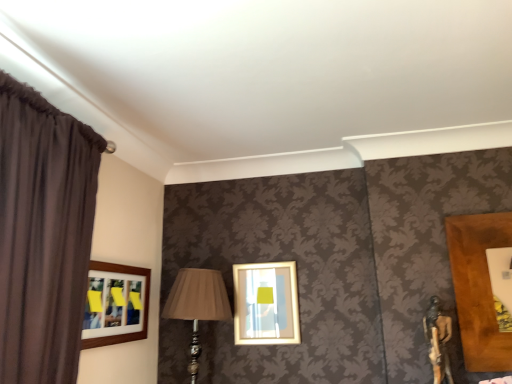
Question: Is matte beige fabric at center taller than wooden-framed picture at left, placed as the 1th picture frame when sorted from left to right?

Choices:
 (A) no
 (B) yes

Answer: (B)

Question: Does matte beige fabric at center have a larger size compared to wooden-framed picture at left, placed as the 1th picture frame when sorted from left to right?

Choices:
 (A) yes
 (B) no

Answer: (A)

Question: From the image's perspective, is matte beige fabric at center located beneath wooden-framed picture at left, placed as the 1th picture frame when sorted from left to right?

Choices:
 (A) yes
 (B) no

Answer: (A)

Question: Considering the relative positions of matte beige fabric at center and wooden-framed picture at left, placed as the second picture frame when sorted from right to left, in the image provided, is matte beige fabric at center to the left of wooden-framed picture at left, placed as the second picture frame when sorted from right to left, from the viewer's perspective?

Choices:
 (A) no
 (B) yes

Answer: (A)

Question: From a real-world perspective, is matte beige fabric at center positioned over wooden-framed picture at left, placed as the second picture frame when sorted from right to left, based on gravity?

Choices:
 (A) yes
 (B) no

Answer: (B)

Question: From their relative heights in the image, would you say matte beige fabric at center is taller or shorter than matte gold picture frame at center, arranged as the 2th picture frame when viewed from the left?

Choices:
 (A) short
 (B) tall

Answer: (B)

Question: Visually, is matte beige fabric at center positioned to the left or to the right of matte gold picture frame at center, which ranks as the 1th picture frame in right-to-left order?

Choices:
 (A) left
 (B) right

Answer: (A)

Question: From the image's perspective, relative to matte gold picture frame at center, which ranks as the 1th picture frame in right-to-left order, is matte beige fabric at center above or below?

Choices:
 (A) below
 (B) above

Answer: (A)

Question: Do you think matte beige fabric at center is within matte gold picture frame at center, which ranks as the 1th picture frame in right-to-left order, or outside of it?

Choices:
 (A) outside
 (B) inside

Answer: (A)

Question: Is dark brown fabric curtain at left spatially inside wooden-framed picture at left, placed as the second picture frame when sorted from right to left, or outside of it?

Choices:
 (A) outside
 (B) inside

Answer: (A)

Question: In terms of size, does dark brown fabric curtain at left appear bigger or smaller than wooden-framed picture at left, placed as the second picture frame when sorted from right to left?

Choices:
 (A) small
 (B) big

Answer: (B)

Question: In the image, is dark brown fabric curtain at left positioned in front of or behind wooden-framed picture at left, placed as the second picture frame when sorted from right to left?

Choices:
 (A) front
 (B) behind

Answer: (A)

Question: Is point (50, 115) closer or farther from the camera than point (97, 279)?

Choices:
 (A) closer
 (B) farther

Answer: (A)

Question: Is wooden-framed picture at left, placed as the second picture frame when sorted from right to left, bigger or smaller than dark brown fabric curtain at left?

Choices:
 (A) small
 (B) big

Answer: (A)

Question: Relative to dark brown fabric curtain at left, is wooden-framed picture at left, placed as the 1th picture frame when sorted from left to right, in front or behind?

Choices:
 (A) behind
 (B) front

Answer: (A)